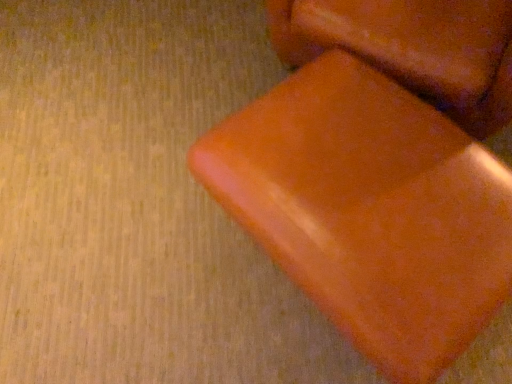
Identify the location of vacant space that is to the left of orange matte block at center. (159, 89).